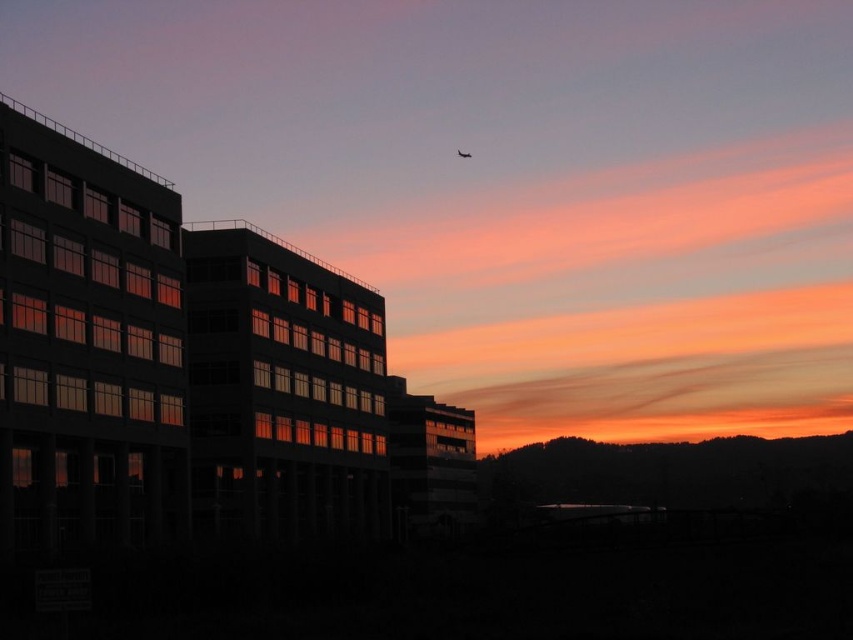
Is matte glass building at left smaller than translucent glass airplane at upper center?

Incorrect, matte glass building at left is not smaller in size than translucent glass airplane at upper center.

Between matte glass building at left and translucent glass airplane at upper center, which one has more height?

matte glass building at left is taller.

Locate an element on the screen. Image resolution: width=853 pixels, height=640 pixels. matte glass building at left is located at coordinates (514, 184).

Locate an element on the screen. Image resolution: width=853 pixels, height=640 pixels. matte glass building at left is located at coordinates (514, 184).